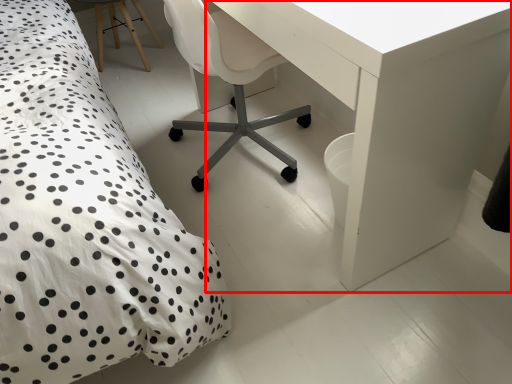
Question: Considering the relative positions of table (annotated by the red box) and chair in the image provided, where is table (annotated by the red box) located with respect to the staircase?

Choices:
 (A) right
 (B) left

Answer: (A)